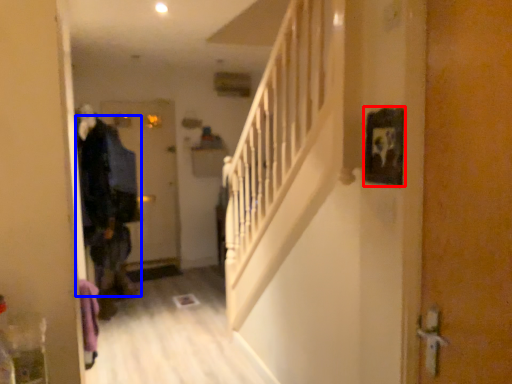
Question: Which point is closer to the camera, picture frame (highlighted by a red box) or clothing (highlighted by a blue box)?

Choices:
 (A) picture frame
 (B) clothing

Answer: (A)